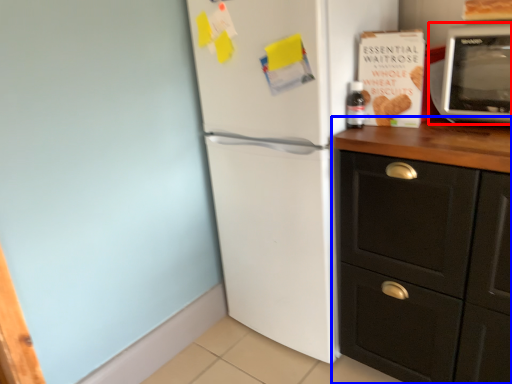
Question: Which of the following is the closest to the observer, microwave oven (highlighted by a red box) or cabinetry (highlighted by a blue box)?

Choices:
 (A) microwave oven
 (B) cabinetry

Answer: (B)